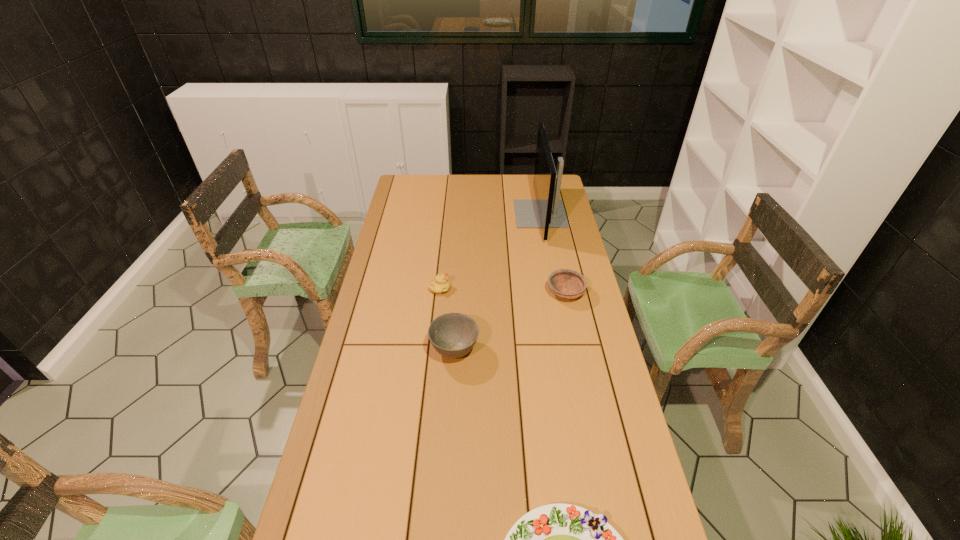
Locate an element on the screen. vacant space at the far left corner of the desktop is located at coordinates (x=418, y=192).

Identify the location of vacant space in between the farthest object and the left bowl. Image resolution: width=960 pixels, height=540 pixels. (497, 282).

The image size is (960, 540). Identify the location of empty location between the nearer bowl and the farthest object. (497, 282).

You are a GUI agent. You are given a task and a screenshot of the screen. Output one action in this format:
    pyautogui.click(x=<x>, y=<y>)
    Task: Click on the vacant space that's between the right bowl and the duckling
    The height and width of the screenshot is (540, 960).
    Given the screenshot: What is the action you would take?
    pyautogui.click(x=503, y=291)

The width and height of the screenshot is (960, 540). Identify the location of empty space that is in between the taller bowl and the computer monitor. (497, 282).

This screenshot has width=960, height=540. What are the coordinates of `empty location between the farther bowl and the nearer bowl` in the screenshot? It's located at (510, 321).

Find the location of a particular element. Image resolution: width=960 pixels, height=540 pixels. unoccupied area between the shorter bowl and the left bowl is located at coordinates (510, 321).

Select which object appears as the closest to the computer monitor. Please provide its 2D coordinates. Your answer should be formatted as a tuple, i.e. [(x, y)], where the tuple contains the x and y coordinates of a point satisfying the conditions above.

[(568, 284)]

Find the location of a particular element. Image resolution: width=960 pixels, height=540 pixels. object that stands as the fourth closest to the duckling is located at coordinates (556, 539).

This screenshot has height=540, width=960. Identify the location of vacant space that satisfies the following two spatial constraints: 1. on the beak of the duckling; 2. on the back side of the left bowl. (434, 350).